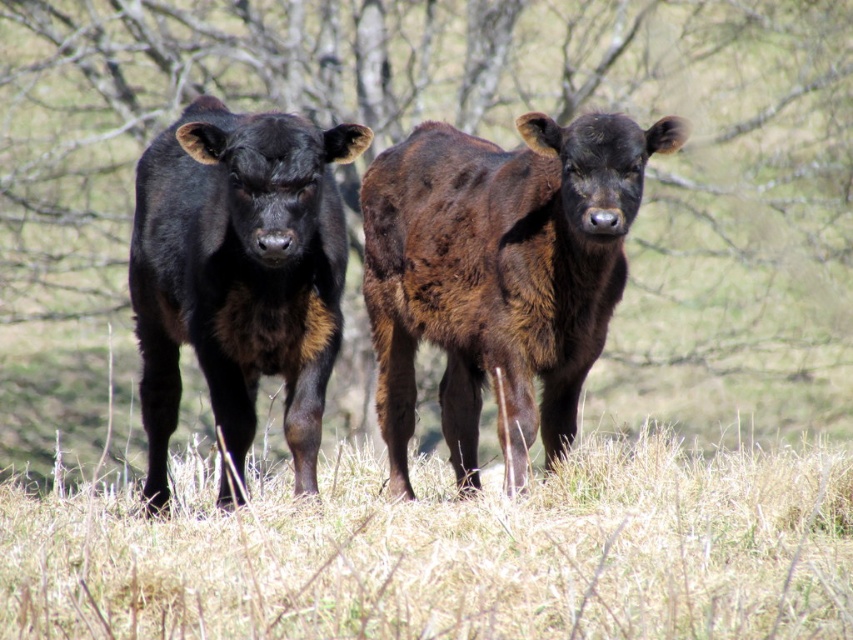
Based on the photo, is dry grass at lower center closer to camera compared to black glossy cow at center?

Yes, dry grass at lower center is in front of black glossy cow at center.

What do you see at coordinates (450, 552) in the screenshot? I see `dry grass at lower center` at bounding box center [450, 552].

Where is `dry grass at lower center`? Image resolution: width=853 pixels, height=640 pixels. dry grass at lower center is located at coordinates tap(450, 552).

Identify the location of shiny brown calf at center. This screenshot has width=853, height=640. (498, 275).

Does point (514, 371) come closer to viewer compared to point (289, 417)?

That is False.

Between point (393, 204) and point (173, 406), which one is positioned behind?

Positioned behind is point (393, 204).

At what (x,y) coordinates should I click in order to perform the action: click on shiny brown calf at center. Please return your answer as a coordinate pair (x, y). This screenshot has height=640, width=853. Looking at the image, I should click on (498, 275).

Does dry grass at lower center have a lesser width compared to shiny brown calf at center?

In fact, dry grass at lower center might be wider than shiny brown calf at center.

Looking at this image, is dry grass at lower center to the left of shiny brown calf at center from the viewer's perspective?

In fact, dry grass at lower center is to the right of shiny brown calf at center.

This screenshot has width=853, height=640. What do you see at coordinates (450, 552) in the screenshot?
I see `dry grass at lower center` at bounding box center [450, 552].

This screenshot has width=853, height=640. I want to click on dry grass at lower center, so (450, 552).